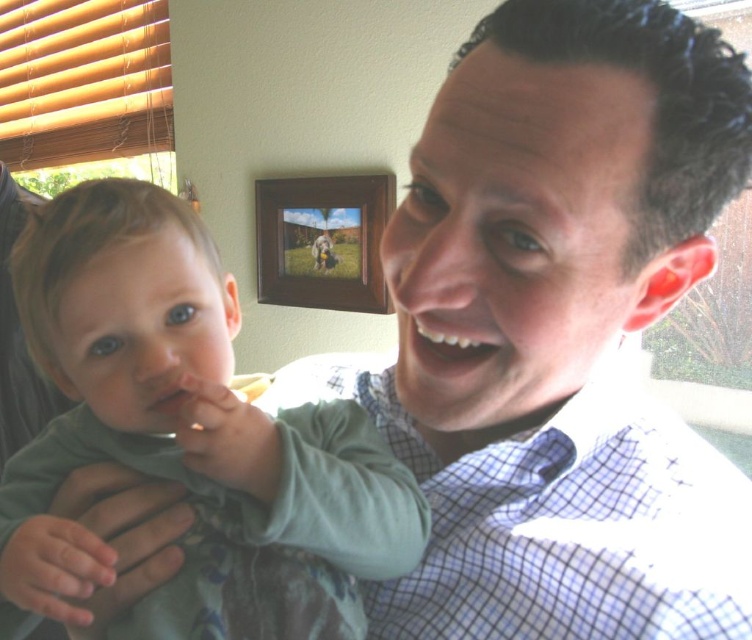
Image resolution: width=752 pixels, height=640 pixels. Find the location of `blue checkered shirt at center`. blue checkered shirt at center is located at coordinates (561, 522).

Is blue checkered shirt at center smaller than pink matte lips at center?

Incorrect, blue checkered shirt at center is not smaller in size than pink matte lips at center.

Looking at this image, who is more forward, (493, 458) or (152, 397)?

Point (152, 397) is in front.

You are a GUI agent. You are given a task and a screenshot of the screen. Output one action in this format:
    pyautogui.click(x=<x>, y=<y>)
    Task: Click on the blue checkered shirt at center
    The image size is (752, 640).
    Given the screenshot: What is the action you would take?
    click(561, 522)

Is point (702, 577) behind point (420, 346)?

Yes, point (702, 577) is farther from viewer.

Who is taller, blue checkered shirt at center or white glossy teeth at center?

Standing taller between the two is blue checkered shirt at center.

Is point (690, 445) closer to viewer compared to point (438, 362)?

No.

In order to click on blue checkered shirt at center in this screenshot , I will do `click(561, 522)`.

The height and width of the screenshot is (640, 752). In order to click on white glossy teeth at center in this screenshot , I will do `click(444, 344)`.

Measure the distance between white glossy teeth at center and pink matte lips at center.

A distance of 6.04 inches exists between white glossy teeth at center and pink matte lips at center.

Who is more forward, (475, 333) or (156, 408)?

Positioned in front is point (475, 333).

Where is `white glossy teeth at center`? white glossy teeth at center is located at coordinates (444, 344).